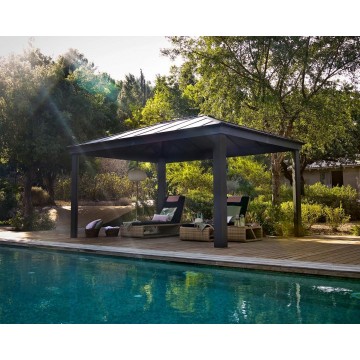
You are a GUI agent. You are given a task and a screenshot of the screen. Output one action in this format:
    pyautogui.click(x=<x>, y=<y>)
    Task: Click on the lounge chairs
    This screenshot has width=360, height=360.
    Given the screenshot: What is the action you would take?
    pyautogui.click(x=125, y=229), pyautogui.click(x=189, y=232)